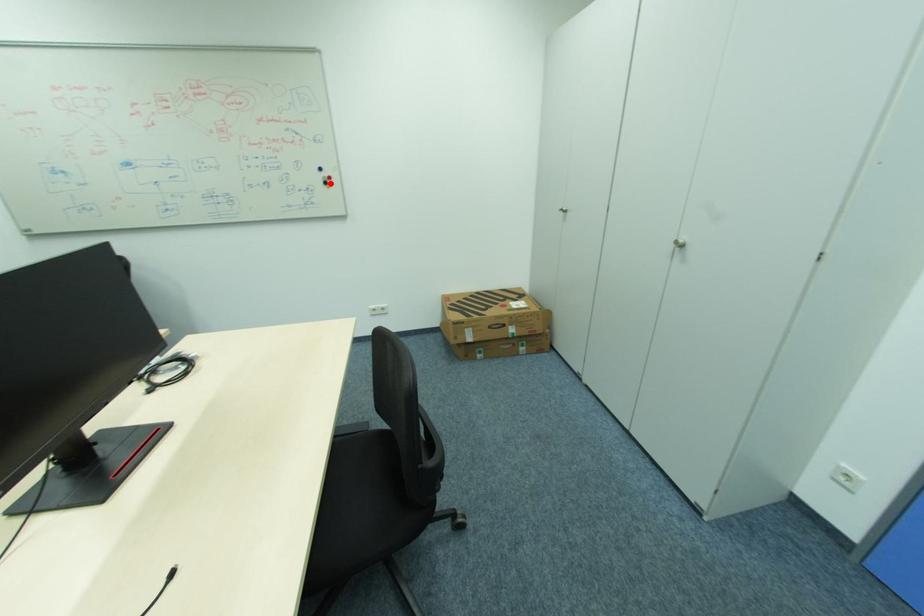
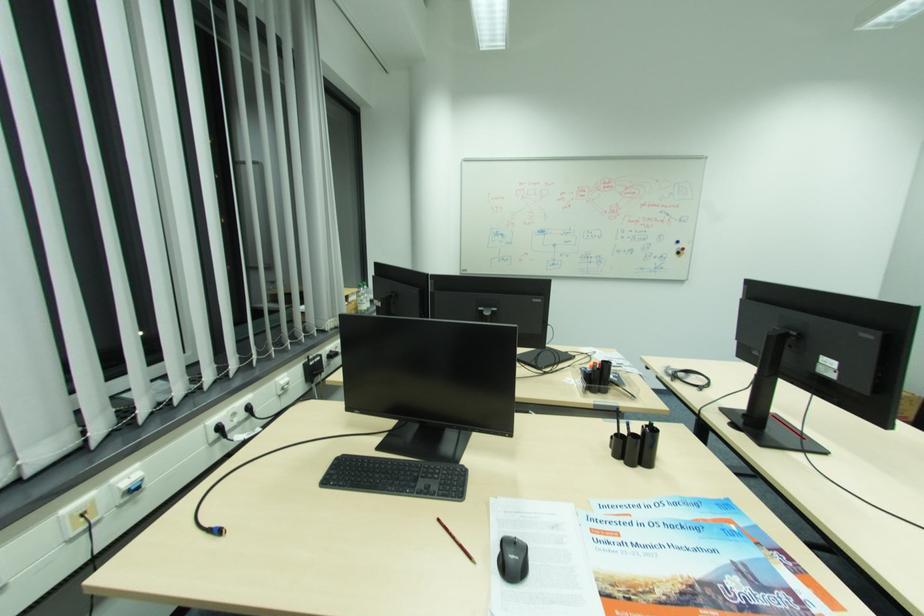
In the second image, find the point that corresponds to the highlighted location in the first image.

(684, 253)